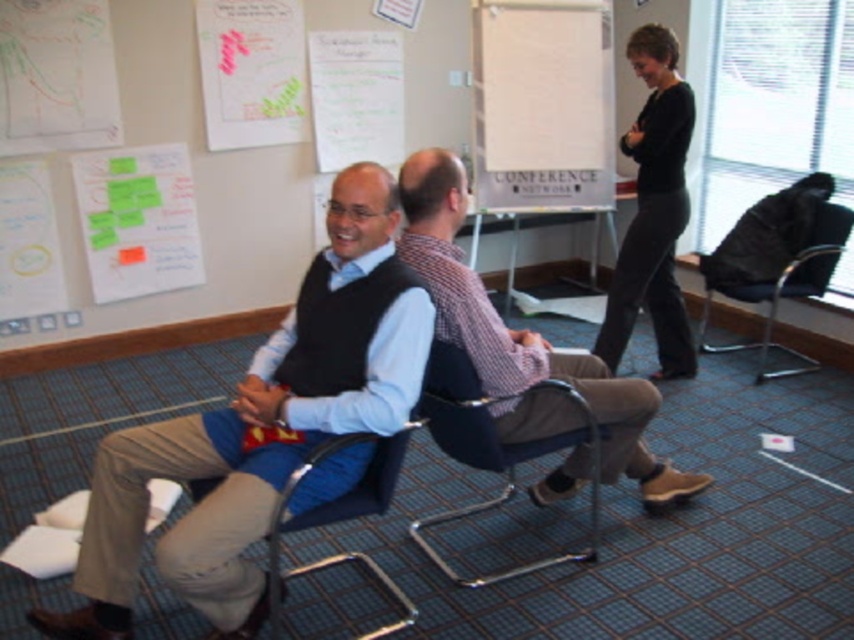
Question: Which of these objects is positioned farthest from the metallic blue chair at center?

Choices:
 (A) blue fabric chair at center
 (B) white paperboard at center
 (C) matte black vest at center
 (D) checkered fabric shirt at center

Answer: (B)

Question: Which of the following is the closest to the observer?

Choices:
 (A) (389, 448)
 (B) (326, 362)
 (C) (636, 419)

Answer: (B)

Question: Is checkered fabric shirt at center wider than metallic blue chair at center?

Choices:
 (A) yes
 (B) no

Answer: (A)

Question: Considering the relative positions of matte black vest at center and checkered fabric shirt at center in the image provided, where is matte black vest at center located with respect to checkered fabric shirt at center?

Choices:
 (A) left
 (B) right

Answer: (A)

Question: Which of the following is the closest to the observer?

Choices:
 (A) (576, 372)
 (B) (355, 508)

Answer: (B)

Question: Is checkered fabric shirt at center bigger than blue fabric chair at center?

Choices:
 (A) no
 (B) yes

Answer: (B)